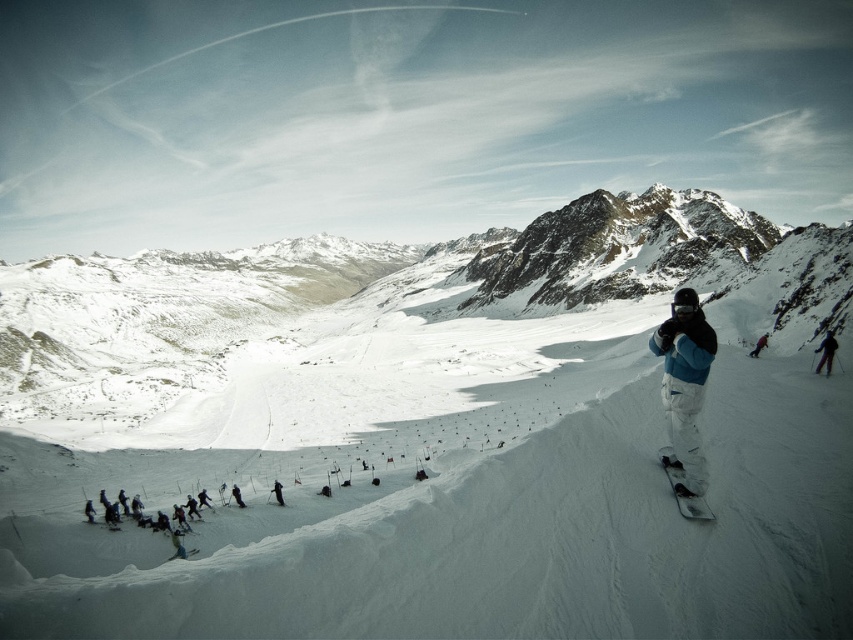
You are a drone operator trying to capture a photo of the black matte snowboarder at right. The camera is positioned at point A, which is at coordinates 0.4, 0.9. The snowboarder is at point B, which is at coordinates 0.552, 0.970. What direction should you move the camera to get the snowboarder centered in the frame?

The black matte snowboarder at right is located at coordinates (827, 353). To center the snowboarder in the frame, the camera at point A (767, 256) should move northeast to align with the snowboarder at point B (827, 353).

You are a photographer positioned at the bottom of the slope. You want to take a photo that includes both the black matte snowboarder at right and the black ski suit at center. Which object will appear larger in your photo?

The black matte snowboarder at right is closer to the viewer than the black ski suit at center, so it will appear larger in the photo.

You are a photographer at the winter scene. You want to capture a photo where the black matte snowboarder at center and the black ski suit at center are both visible. Which one should be positioned to the left in your photo?

The black ski suit at center should be positioned to the left in your photo because the black matte snowboarder at center is to the right of it.